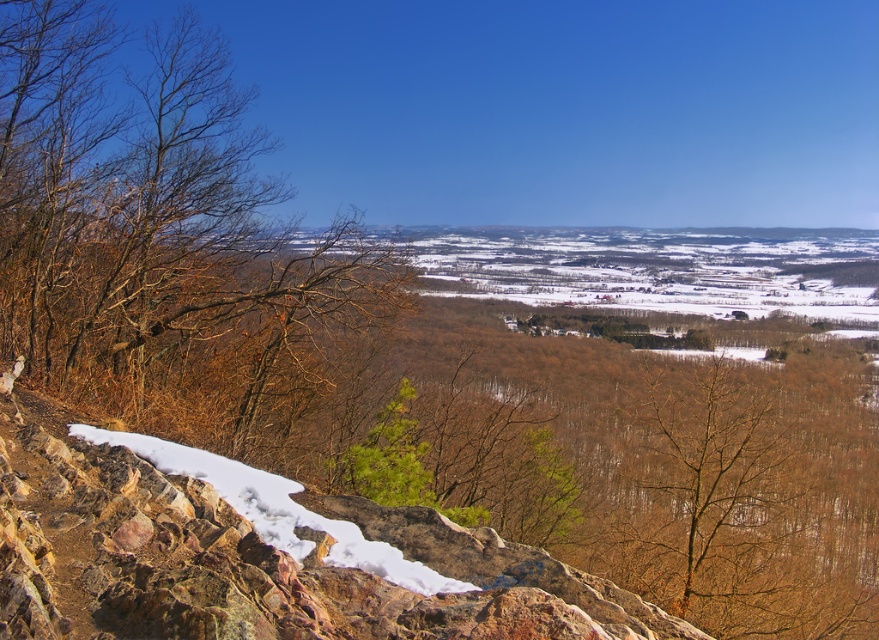
Question: Which point appears farthest from the camera in this image?

Choices:
 (A) (292, 324)
 (B) (616, 564)

Answer: (A)

Question: Among these objects, which one is farthest from the camera?

Choices:
 (A) brown leafless tree at center
 (B) brown leafless branches at left

Answer: (A)

Question: Which object is closer to the camera taking this photo?

Choices:
 (A) brown leafless tree at center
 (B) brown leafless branches at left

Answer: (B)

Question: Can you confirm if brown leafless branches at left is positioned below brown leafless tree at center?

Choices:
 (A) yes
 (B) no

Answer: (B)

Question: Does brown leafless branches at left appear over brown leafless tree at center?

Choices:
 (A) yes
 (B) no

Answer: (A)

Question: Is brown leafless branches at left to the right of brown leafless tree at center from the viewer's perspective?

Choices:
 (A) no
 (B) yes

Answer: (A)